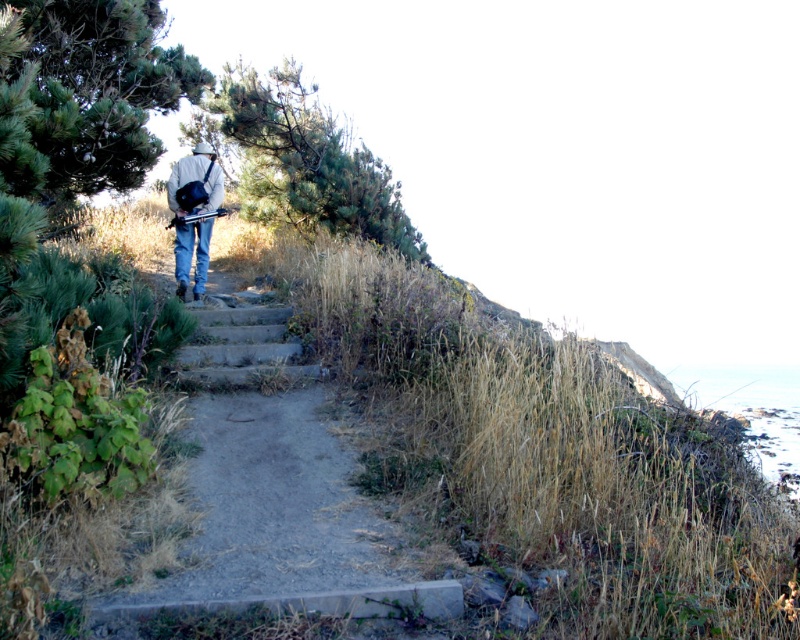
Question: Is dull concrete steps at center to the right of denim jacket at upper center from the viewer's perspective?

Choices:
 (A) no
 (B) yes

Answer: (B)

Question: Which of the following is the closest to the observer?

Choices:
 (A) (186, 164)
 (B) (240, 394)

Answer: (B)

Question: Which of the following is the closest to the observer?

Choices:
 (A) denim jacket at upper center
 (B) dull concrete steps at center

Answer: (B)

Question: Is dull concrete steps at center to the right of denim jacket at upper center from the viewer's perspective?

Choices:
 (A) yes
 (B) no

Answer: (A)

Question: Is dull concrete steps at center wider than denim jacket at upper center?

Choices:
 (A) yes
 (B) no

Answer: (A)